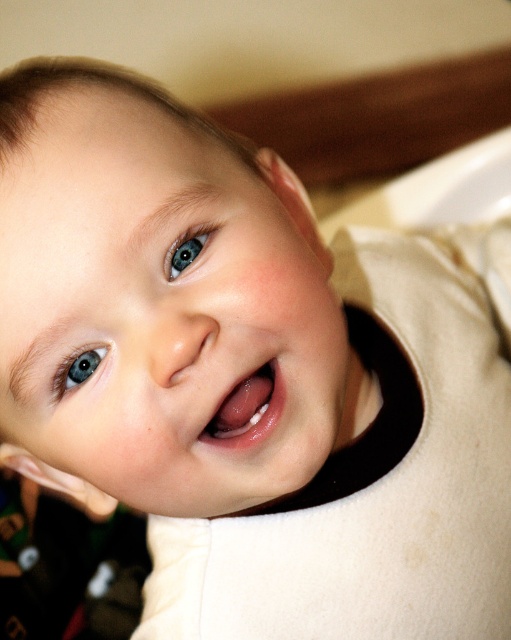
You are a photographer trying to capture the baby in the image. If you want to focus on the pink glossy tongue at center and the blue glossy eye at upper center, which one is closer to the bottom of the image?

The pink glossy tongue at center is closer to the bottom of the image because it is located below the blue glossy eye at upper center.

You are a photographer adjusting the focus on your camera. You want to ensure both the blue glossy eye at upper left and the blue glossy eye at upper center are in focus. Given that your camera can focus on objects within a 2 inch range, will both eyes be in focus?

The distance between the blue glossy eye at upper left and the blue glossy eye at upper center is 2.34 inches. Since the camera can only focus within a 2 inch range, the two eyes are slightly out of the focus range, so they might not both be in focus.

You are a photographer trying to capture the baby in the image. The pink glossy tongue at center and the blue glossy eye at upper left are both in focus. Which object is closer to the bottom edge of the image?

The pink glossy tongue at center is closer to the bottom edge of the image because it is located below the blue glossy eye at upper left.